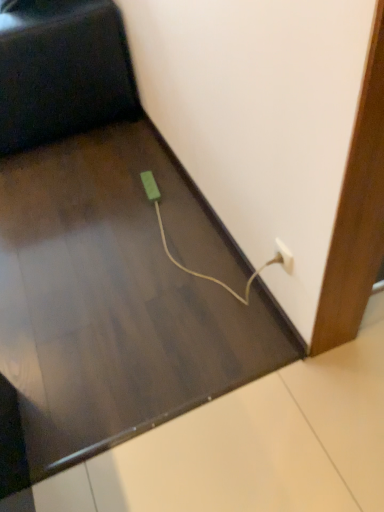
Question: From a real-world perspective, does green matte plug at lower center sit lower than black matte chair at upper left?

Choices:
 (A) no
 (B) yes

Answer: (B)

Question: Is green matte plug at lower center oriented away from black matte chair at upper left?

Choices:
 (A) yes
 (B) no

Answer: (B)

Question: Are green matte plug at lower center and black matte chair at upper left far apart?

Choices:
 (A) yes
 (B) no

Answer: (B)

Question: Does green matte plug at lower center come in front of black matte chair at upper left?

Choices:
 (A) no
 (B) yes

Answer: (A)

Question: Can you confirm if green matte plug at lower center is shorter than black matte chair at upper left?

Choices:
 (A) yes
 (B) no

Answer: (A)

Question: Is white plastic plug at lower right bigger or smaller than black matte chair at upper left?

Choices:
 (A) big
 (B) small

Answer: (B)

Question: Is white plastic plug at lower right inside the boundaries of black matte chair at upper left, or outside?

Choices:
 (A) outside
 (B) inside

Answer: (A)

Question: From a real-world perspective, is white plastic plug at lower right physically located above or below black matte chair at upper left?

Choices:
 (A) below
 (B) above

Answer: (A)

Question: Would you say white plastic plug at lower right is to the left or to the right of black matte chair at upper left in the picture?

Choices:
 (A) right
 (B) left

Answer: (A)

Question: Considering the relative positions of black matte chair at upper left and green matte plug at lower center in the image provided, is black matte chair at upper left to the left or to the right of green matte plug at lower center?

Choices:
 (A) left
 (B) right

Answer: (A)

Question: From the image's perspective, is black matte chair at upper left above or below green matte plug at lower center?

Choices:
 (A) below
 (B) above

Answer: (B)

Question: Considering the positions of point (54, 53) and point (150, 193), is point (54, 53) closer or farther from the camera than point (150, 193)?

Choices:
 (A) closer
 (B) farther

Answer: (B)

Question: Considering the positions of black matte chair at upper left and green matte plug at lower center in the image, is black matte chair at upper left bigger or smaller than green matte plug at lower center?

Choices:
 (A) small
 (B) big

Answer: (B)

Question: Considering the positions of point (289, 252) and point (152, 189), is point (289, 252) closer or farther from the camera than point (152, 189)?

Choices:
 (A) closer
 (B) farther

Answer: (A)

Question: Considering their positions, is white plastic plug at lower right located in front of or behind green matte plug at lower center?

Choices:
 (A) front
 (B) behind

Answer: (A)